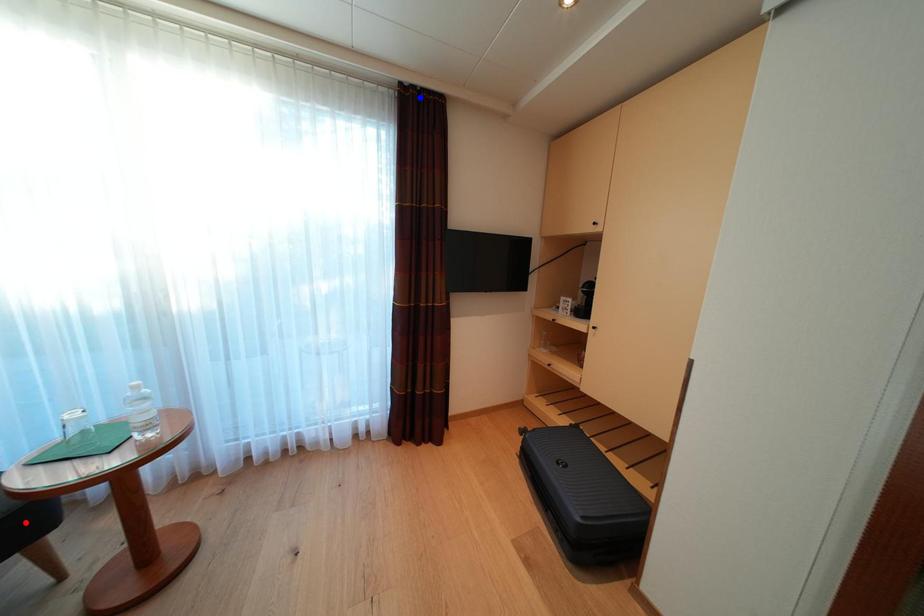
Question: In the image, two points are highlighted. Which point is nearer to the camera? Reply with the corresponding letter.

Choices:
 (A) blue point
 (B) red point

Answer: (B)